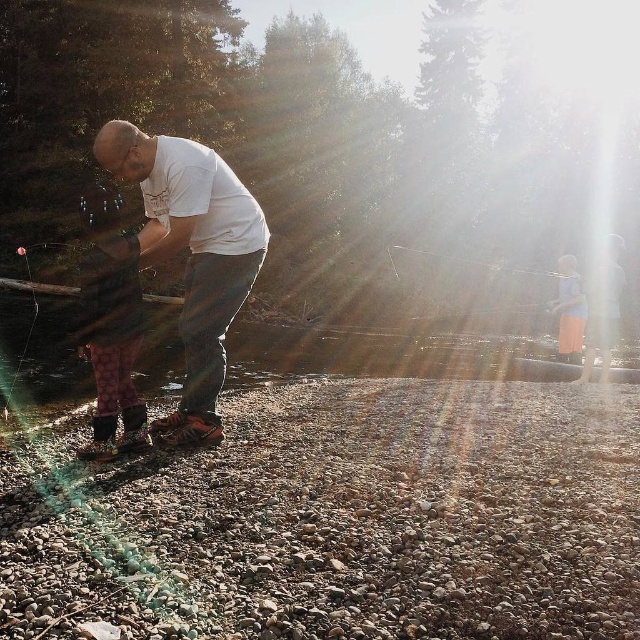
Between white matte shirt at center and patterned fabric pants at left, which one has less height?

patterned fabric pants at left is shorter.

Where is `white matte shirt at center`? The width and height of the screenshot is (640, 640). white matte shirt at center is located at coordinates (189, 256).

I want to click on white matte shirt at center, so click(x=189, y=256).

Locate an element on the screen. white matte shirt at center is located at coordinates pos(189,256).

Is patterned fabric pants at left to the right of light blue fabric dress at right from the viewer's perspective?

Incorrect, patterned fabric pants at left is not on the right side of light blue fabric dress at right.

Measure the distance between patterned fabric pants at left and light blue fabric dress at right.

A distance of 6.87 meters exists between patterned fabric pants at left and light blue fabric dress at right.

Is point (113, 390) farther from camera compared to point (561, 294)?

No.

Find the location of `patterned fabric pants at left`. patterned fabric pants at left is located at coordinates (112, 324).

Between white matte shirt at center and light blue fabric dress at right, which one is positioned lower?

white matte shirt at center is lower down.

Is white matte shirt at center above light blue fabric dress at right?

No.

Where is `white matte shirt at center`? This screenshot has height=640, width=640. white matte shirt at center is located at coordinates (189, 256).

Where is `white matte shirt at center`? This screenshot has width=640, height=640. white matte shirt at center is located at coordinates (189, 256).